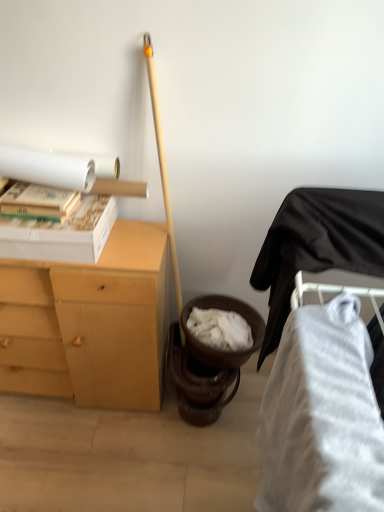
Locate an element on the screen. The height and width of the screenshot is (512, 384). free location in front of white matte book at upper left is located at coordinates (38, 229).